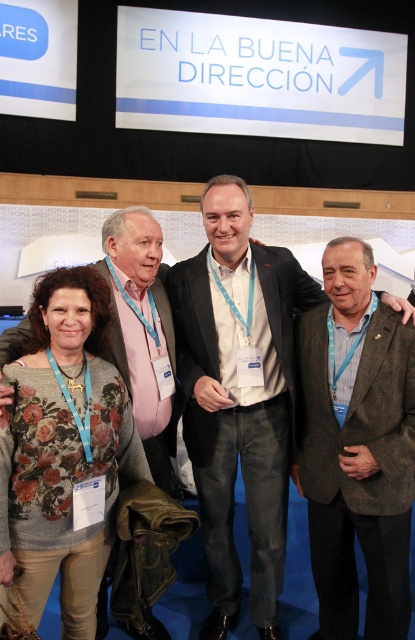
Question: Does light brown woolen blazer at center have a smaller size compared to brown woolen jacket at center?

Choices:
 (A) yes
 (B) no

Answer: (B)

Question: Estimate the real-world distances between objects in this image. Which object is farther from the brown woolen jacket at center?

Choices:
 (A) floral sweater at lower left
 (B) light brown woolen blazer at center

Answer: (A)

Question: Is light brown woolen blazer at center thinner than brown woolen jacket at center?

Choices:
 (A) yes
 (B) no

Answer: (B)

Question: Among these objects, which one is farthest from the camera?

Choices:
 (A) floral sweater at lower left
 (B) light brown woolen blazer at center
 (C) brown woolen jacket at center

Answer: (B)

Question: Is light brown woolen blazer at center bigger than brown woolen jacket at center?

Choices:
 (A) yes
 (B) no

Answer: (A)

Question: Which is nearer to the brown woolen jacket at center?

Choices:
 (A) light brown woolen blazer at center
 (B) floral sweater at lower left

Answer: (A)